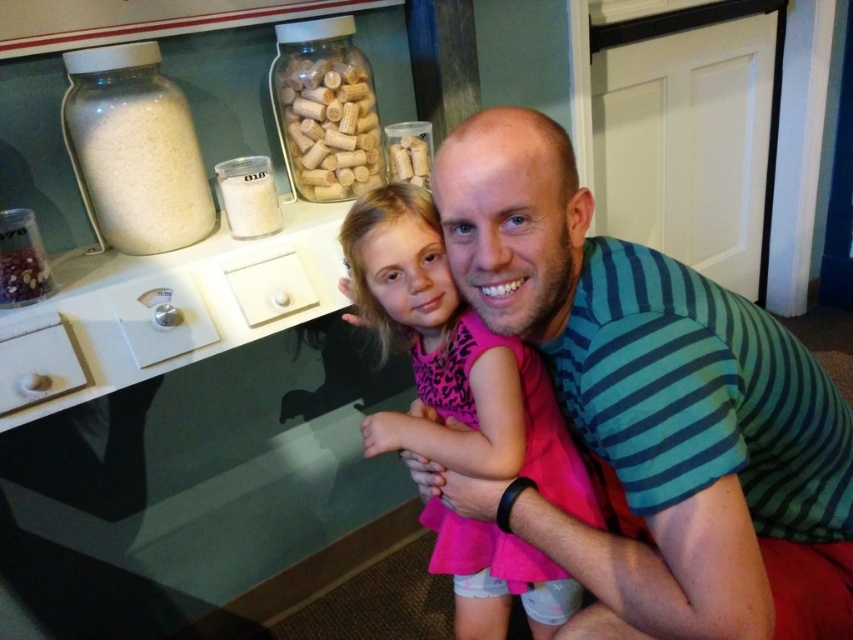
Consider the image. Is green striped shirt at center taller than pink fabric dress at center?

No.

Between point (828, 538) and point (486, 577), which one is positioned in front?

Point (828, 538) is more forward.

Describe the element at coordinates (656, 404) in the screenshot. I see `green striped shirt at center` at that location.

This screenshot has height=640, width=853. Find the location of `green striped shirt at center`. green striped shirt at center is located at coordinates (656, 404).

Can you confirm if pink fabric dress at center is thinner than wooden corks at upper center?

No, pink fabric dress at center is not thinner than wooden corks at upper center.

Who is positioned more to the left, pink fabric dress at center or wooden corks at upper center?

From the viewer's perspective, wooden corks at upper center appears more on the left side.

Where is `pink fabric dress at center`? The image size is (853, 640). pink fabric dress at center is located at coordinates (453, 358).

Which is more to the right, pink fabric dress at center or shiny metallic beads at left?

Positioned to the right is pink fabric dress at center.

Where is `pink fabric dress at center`? pink fabric dress at center is located at coordinates (453, 358).

The height and width of the screenshot is (640, 853). I want to click on pink fabric dress at center, so click(453, 358).